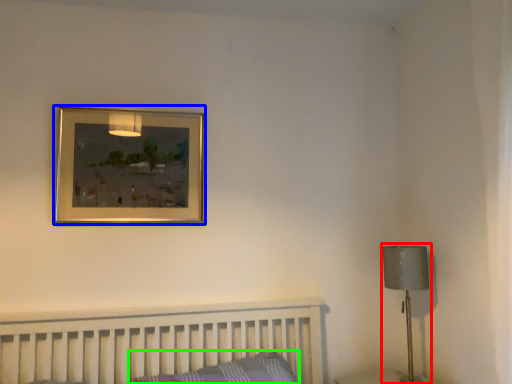
Question: Estimate the real-world distances between objects in this image. Which object is closer to table lamp (highlighted by a red box), picture frame (highlighted by a blue box) or pillow (highlighted by a green box)?

Choices:
 (A) picture frame
 (B) pillow

Answer: (B)